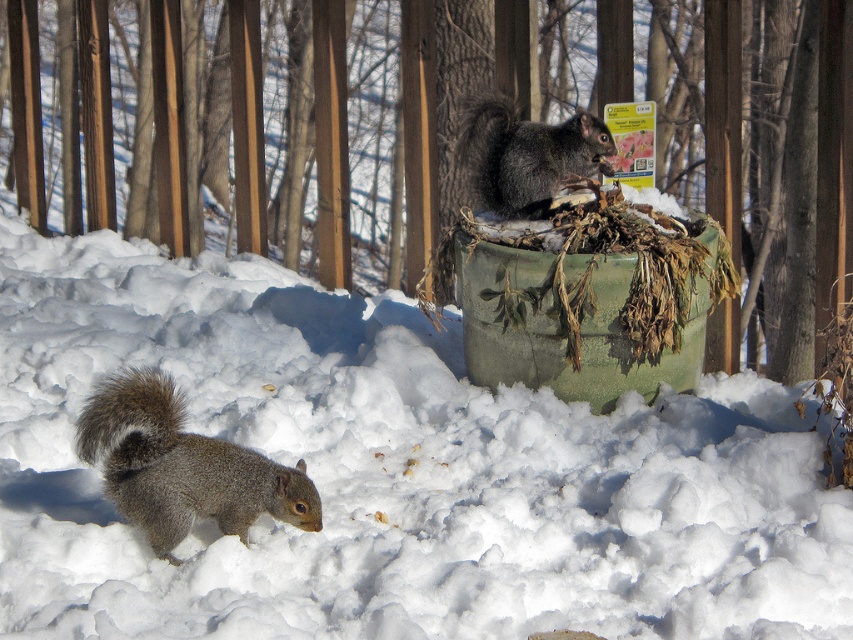
Between point (286, 611) and point (224, 492), which one is positioned in front?

Point (286, 611) is more forward.

Does white fluffy snow at lower center appear on the left side of gray furry squirrel at lower left?

In fact, white fluffy snow at lower center is to the right of gray furry squirrel at lower left.

Is point (741, 467) farther from camera compared to point (141, 428)?

Yes, point (741, 467) is behind point (141, 428).

The height and width of the screenshot is (640, 853). Identify the location of white fluffy snow at lower center. (392, 474).

Can you confirm if gray furry squirrel at lower left is thinner than shiny black squirrel at center?

Incorrect, gray furry squirrel at lower left's width is not less than shiny black squirrel at center's.

Can you confirm if gray furry squirrel at lower left is bigger than shiny black squirrel at center?

Yes.

Which is in front, point (160, 424) or point (508, 152)?

Point (160, 424) is in front.

Identify the location of gray furry squirrel at lower left. (183, 465).

Based on the photo, how far apart are white fluffy snow at lower center and shiny black squirrel at center?

The distance of white fluffy snow at lower center from shiny black squirrel at center is 3.81 feet.

Who is positioned more to the left, white fluffy snow at lower center or shiny black squirrel at center?

Result: Positioned to the left is white fluffy snow at lower center.

You are a GUI agent. You are given a task and a screenshot of the screen. Output one action in this format:
    pyautogui.click(x=<x>, y=<y>)
    Task: Click on the white fluffy snow at lower center
    
    Given the screenshot: What is the action you would take?
    pyautogui.click(x=392, y=474)